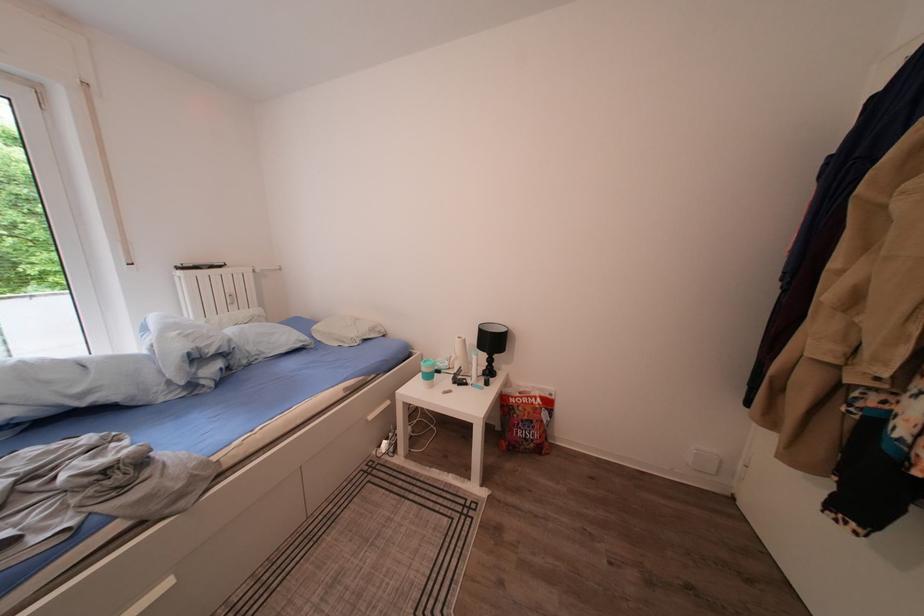
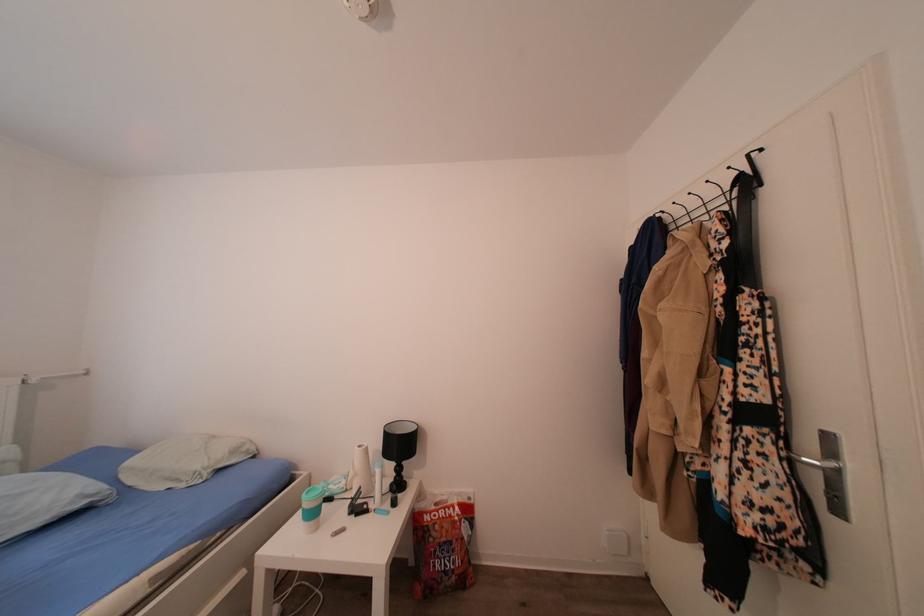
Question: The images are taken continuously from a first-person perspective. In which direction are you moving?

Choices:
 (A) Left
 (B) Right
 (C) Forward
 (D) Backward

Answer: (B)